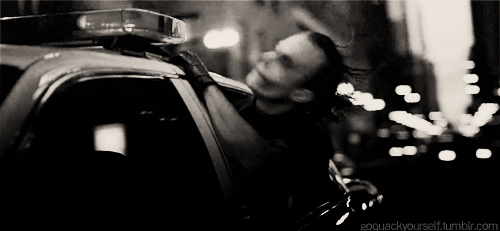
Locate an element on the screen. window is located at coordinates (99, 158), (268, 198).